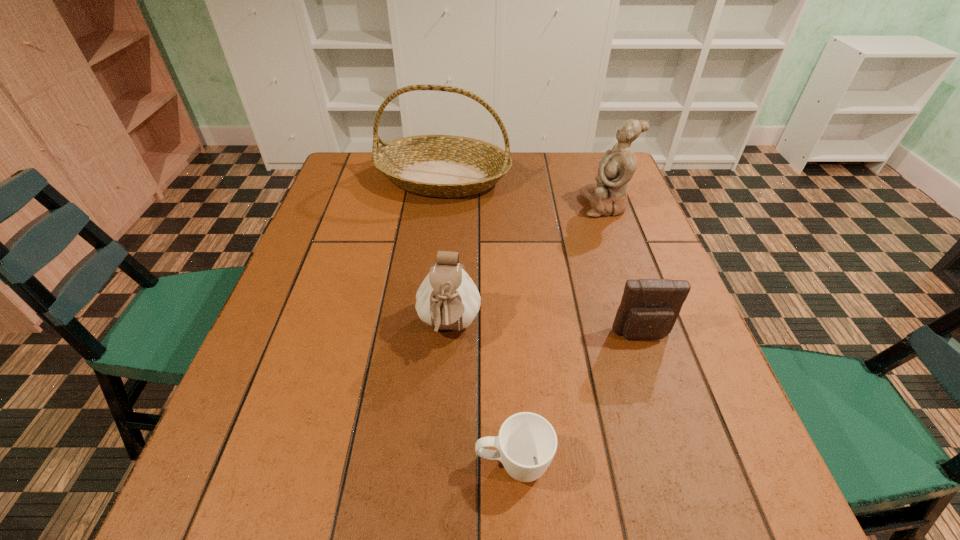
Identify the location of object present at the left edge. (445, 166).

Identify the location of figurine positioned at the right edge. This screenshot has width=960, height=540. (608, 196).

What are the coordinates of `pouch at the right edge` in the screenshot? It's located at (649, 308).

In order to click on object that is positioned at the far left corner in this screenshot , I will do `click(445, 166)`.

Identify the location of object situated at the far right corner. Image resolution: width=960 pixels, height=540 pixels. (608, 196).

The image size is (960, 540). I want to click on blank area at the far edge, so click(565, 183).

I want to click on free space at the left edge, so coord(296,361).

The width and height of the screenshot is (960, 540). I want to click on free space at the near left corner of the desktop, so click(282, 511).

Find the location of a particular element. The width and height of the screenshot is (960, 540). vacant space at the far right corner is located at coordinates (578, 158).

Locate an element on the screen. This screenshot has width=960, height=540. vacant space that's between the basket and the figurine is located at coordinates (524, 192).